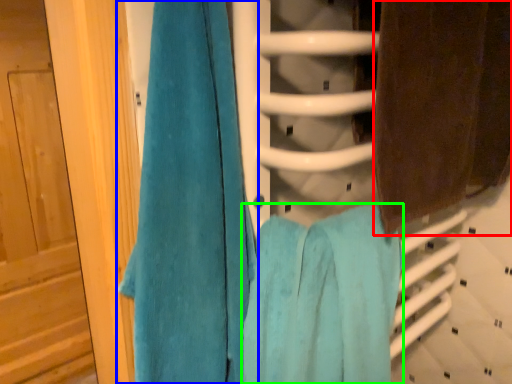
Question: Considering the real-world distances, which object is farthest from towel (highlighted by a red box)? towel (highlighted by a blue box) or towel (highlighted by a green box)?

Choices:
 (A) towel
 (B) towel

Answer: (A)